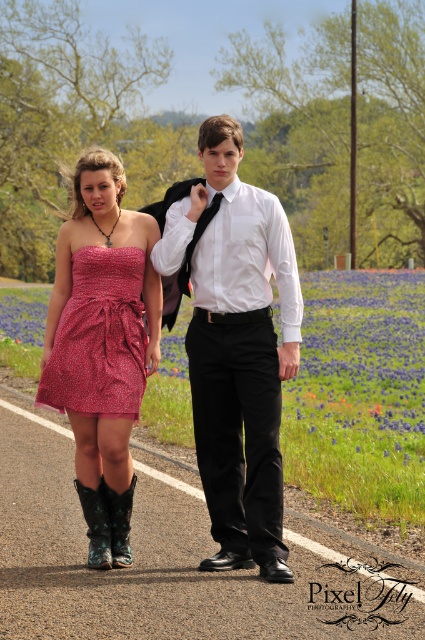
Question: Which point is closer to the camera taking this photo?

Choices:
 (A) (110, 524)
 (B) (31, 332)
 (C) (186, 250)

Answer: (A)

Question: Is white smooth shirt at center in front of leather/cowboy boot at lower left?

Choices:
 (A) yes
 (B) no

Answer: (A)

Question: Among these objects, which one is nearest to the camera?

Choices:
 (A) matte red dress at center
 (B) black satin tie at center
 (C) leather/cowboy boot at lower left
 (D) white smooth shirt at center

Answer: (D)

Question: Observing the image, what is the correct spatial positioning of white smooth shirt at center in reference to red satin dress at center?

Choices:
 (A) left
 (B) right

Answer: (B)

Question: Is purple fabric flower field at center further to camera compared to green suede cowboy boot at lower left?

Choices:
 (A) yes
 (B) no

Answer: (A)

Question: Which point is closer to the camera taking this photo?

Choices:
 (A) (138, 356)
 (B) (402, 292)
 (C) (84, 513)

Answer: (C)